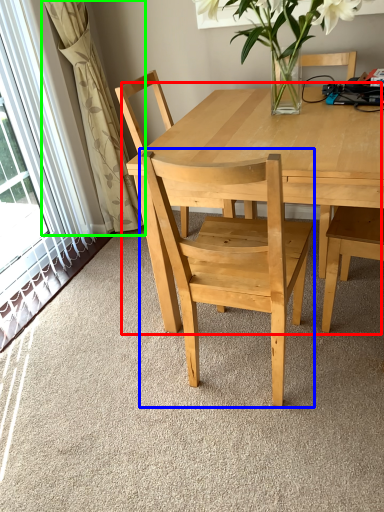
Question: Estimate the real-world distances between objects in this image. Which object is closer to kitchen & dining room table (highlighted by a red box), chair (highlighted by a blue box) or curtain (highlighted by a green box)?

Choices:
 (A) chair
 (B) curtain

Answer: (A)